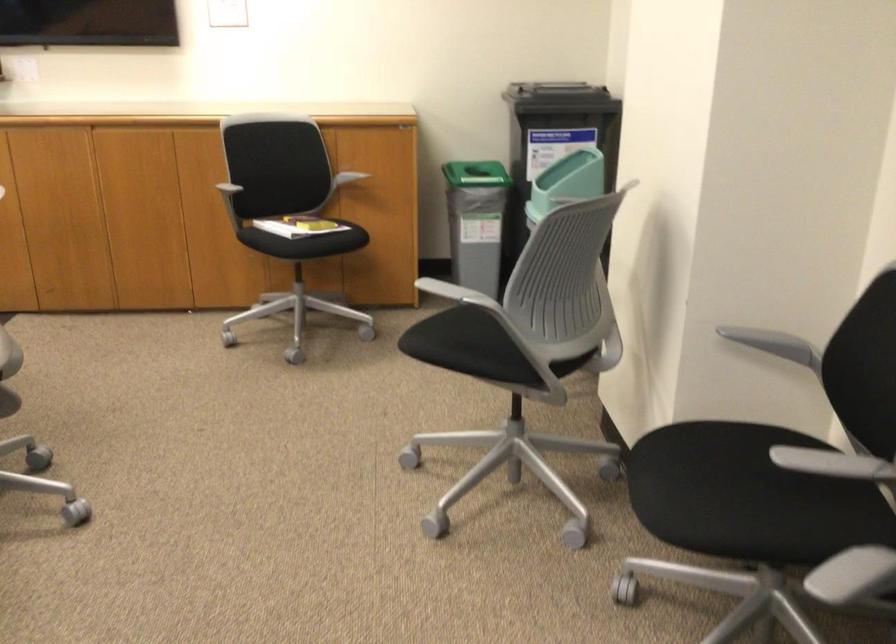
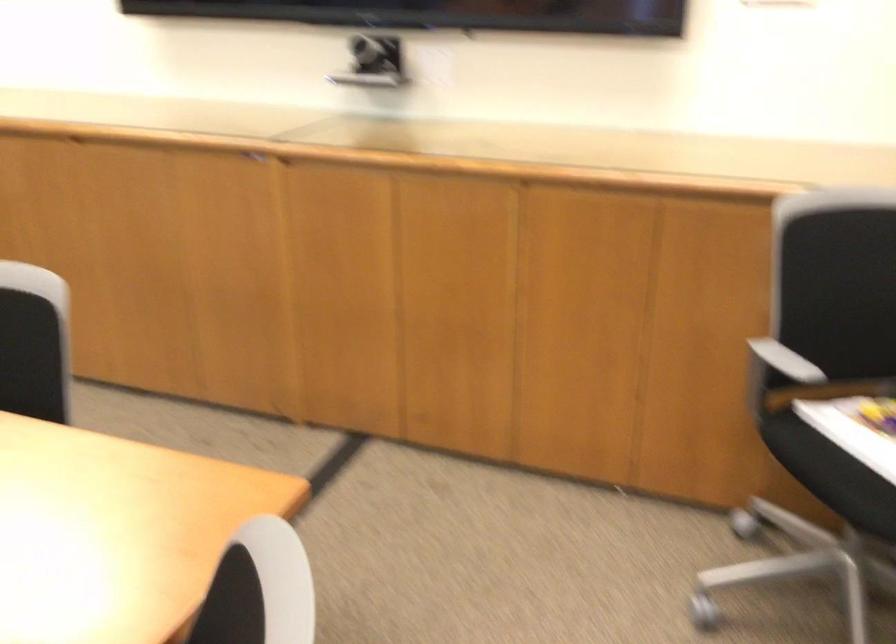
Which direction would the cameraman need to move to produce the second image?

Answer: The movement direction of the cameraman is left, forward.